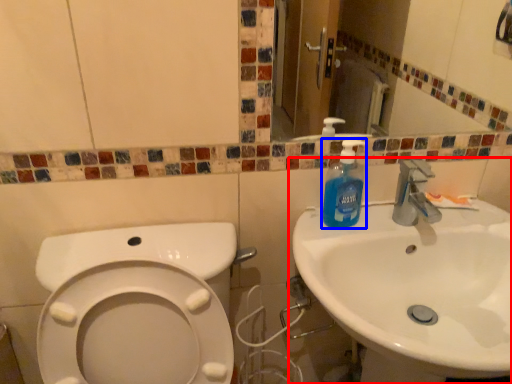
Question: Among these objects, which one is nearest to the camera, sink (highlighted by a red box) or cleaning product (highlighted by a blue box)?

Choices:
 (A) sink
 (B) cleaning product

Answer: (A)